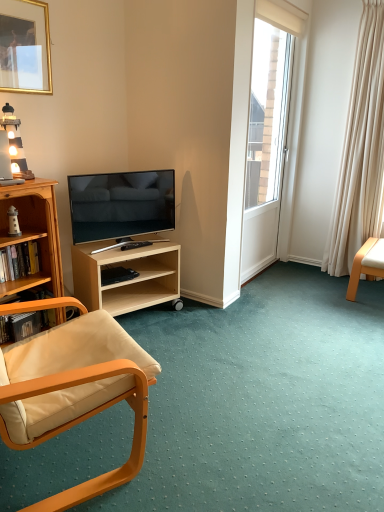
Question: From the image's perspective, is wooden lighthouse at upper left on matte black tv at center left?

Choices:
 (A) yes
 (B) no

Answer: (A)

Question: Does wooden lighthouse at upper left come behind matte black tv at center left?

Choices:
 (A) no
 (B) yes

Answer: (A)

Question: From a real-world perspective, is wooden lighthouse at upper left under matte black tv at center left?

Choices:
 (A) no
 (B) yes

Answer: (A)

Question: Does wooden lighthouse at upper left have a lesser height compared to matte black tv at center left?

Choices:
 (A) yes
 (B) no

Answer: (A)

Question: From the image's perspective, is wooden lighthouse at upper left below matte black tv at center left?

Choices:
 (A) yes
 (B) no

Answer: (B)

Question: Do you think white glossy door at upper right is within gold metallic picture frame at upper left, or outside of it?

Choices:
 (A) outside
 (B) inside

Answer: (A)

Question: In the image, is white glossy door at upper right on the left side or the right side of gold metallic picture frame at upper left?

Choices:
 (A) left
 (B) right

Answer: (B)

Question: Considering the positions of point (291, 55) and point (39, 55), is point (291, 55) closer or farther from the camera than point (39, 55)?

Choices:
 (A) farther
 (B) closer

Answer: (A)

Question: In the image, is white glossy door at upper right positioned in front of or behind gold metallic picture frame at upper left?

Choices:
 (A) behind
 (B) front

Answer: (A)

Question: From their relative heights in the image, would you say matte wood chair at left, which ranks as the first chair in front-to-back order, is taller or shorter than black plastic remote control at lower center?

Choices:
 (A) tall
 (B) short

Answer: (A)

Question: Considering the positions of matte wood chair at left, the 2th chair in the back-to-front sequence, and black plastic remote control at lower center in the image, is matte wood chair at left, the 2th chair in the back-to-front sequence, wider or thinner than black plastic remote control at lower center?

Choices:
 (A) thin
 (B) wide

Answer: (B)

Question: Visually, is matte wood chair at left, the second chair in the right-to-left sequence, positioned to the left or to the right of black plastic remote control at lower center?

Choices:
 (A) left
 (B) right

Answer: (A)

Question: Considering the positions of point (82, 370) and point (130, 243), is point (82, 370) closer or farther from the camera than point (130, 243)?

Choices:
 (A) farther
 (B) closer

Answer: (B)

Question: Is black plastic remote control at lower center inside the boundaries of hardcover book at left, or outside?

Choices:
 (A) inside
 (B) outside

Answer: (B)

Question: Based on their sizes in the image, would you say black plastic remote control at lower center is bigger or smaller than hardcover book at left?

Choices:
 (A) small
 (B) big

Answer: (A)